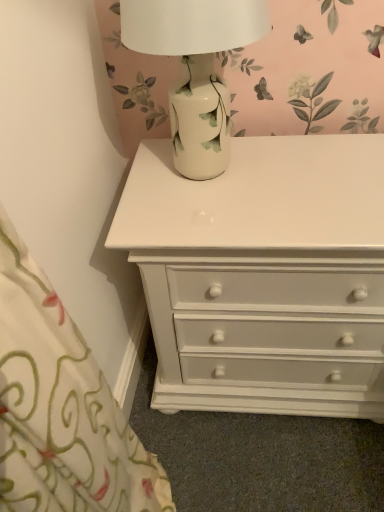
Identify the location of free space in front of porcelain vase at upper center. (232, 223).